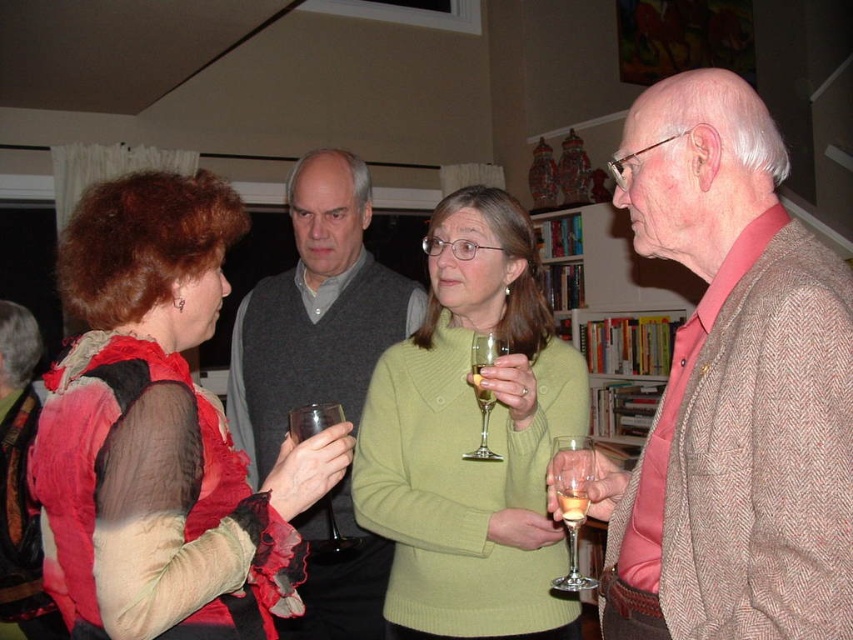
Is clear glass wine glass at lower right to the left of translucent glass wine at center from the viewer's perspective?

Incorrect, clear glass wine glass at lower right is not on the left side of translucent glass wine at center.

Describe the element at coordinates (572, 502) in the screenshot. I see `clear glass wine glass at lower right` at that location.

Locate an element on the screen. This screenshot has height=640, width=853. clear glass wine glass at lower right is located at coordinates (572, 502).

Is green knitted sweater at center above wooden bookshelf at center?

No, green knitted sweater at center is not above wooden bookshelf at center.

Between point (498, 499) and point (599, 232), which one is positioned in front?

Positioned in front is point (498, 499).

The width and height of the screenshot is (853, 640). What do you see at coordinates (471, 440) in the screenshot? I see `green knitted sweater at center` at bounding box center [471, 440].

At what (x,y) coordinates should I click in order to perform the action: click on green knitted sweater at center. Please return your answer as a coordinate pair (x, y). This screenshot has width=853, height=640. Looking at the image, I should click on (471, 440).

The width and height of the screenshot is (853, 640). I want to click on brown herringbone blazer at center, so click(730, 388).

Who is more forward, (845,342) or (573,515)?

Point (845,342)

Between point (700, 506) and point (572, 518), which one is positioned in front?

Positioned in front is point (700, 506).

Where is `brown herringbone blazer at center`? The height and width of the screenshot is (640, 853). brown herringbone blazer at center is located at coordinates [x=730, y=388].